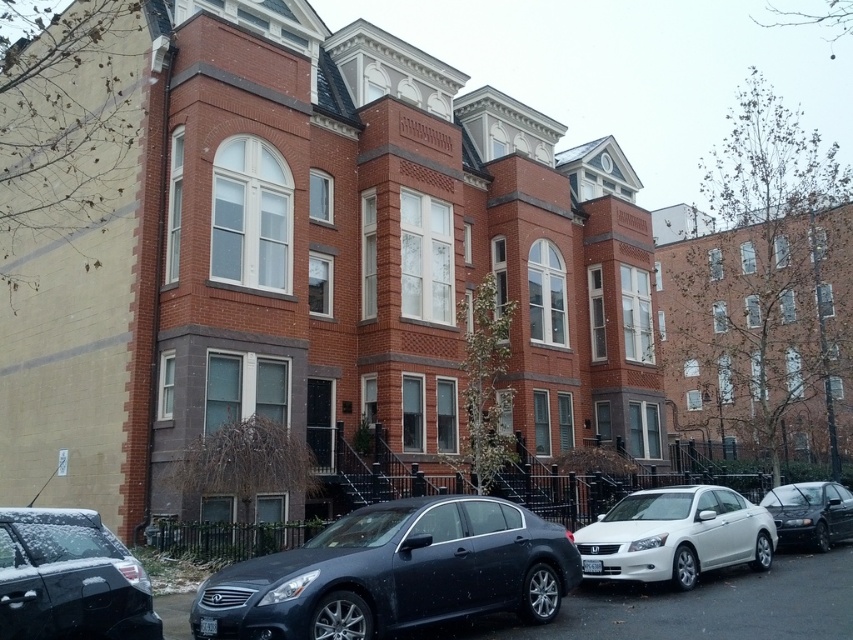
From the picture: You are a delivery driver who needs to park your 2.5 meter wide truck between the satin black sedan at center and the white glossy sedan at center. Can your truck fit in the space between them?

The satin black sedan at center is wider than the white glossy sedan at center. Therefore, the space between them may not be wide enough for a 2.5 meter wide truck as the total width of both sedans combined is greater than the space available.

You are standing at the point labeled point [395,573] in front of the row of buildings. What is the color of the car you are standing next to?

The point [395,573] corresponds to the satin black sedan at center, so the color of the car you are standing next to is black.

You are a pedestrian standing on the sidewalk in front of the multi story brick buildings. You see a satin black sedan at center and a white glossy sedan at center. Which sedan is closer to you?

The satin black sedan at center is closer to the viewer than the white glossy sedan at center.